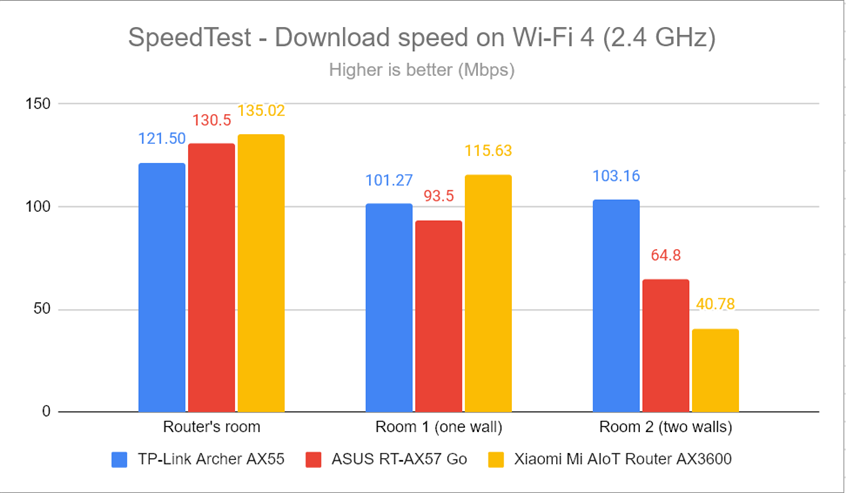
Locate an element on the screen. room 2 (two walls) is located at coordinates (607, 421).